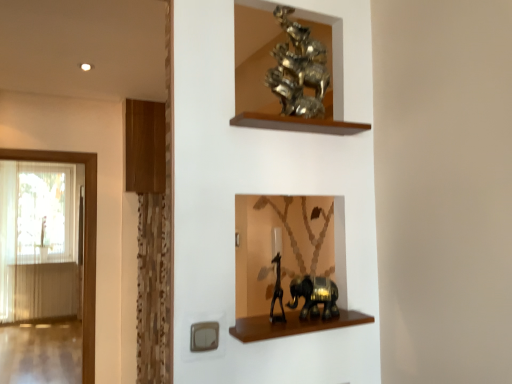
Question: Does brown wooden shelf at lower center, the second shelf viewed from the back, have a larger size compared to translucent glass door at left?

Choices:
 (A) yes
 (B) no

Answer: (B)

Question: Does brown wooden shelf at lower center, the first shelf positioned from the front, have a lesser width compared to translucent glass door at left?

Choices:
 (A) no
 (B) yes

Answer: (A)

Question: From a real-world perspective, is brown wooden shelf at lower center, the second shelf in the left-to-right sequence, on top of translucent glass door at left?

Choices:
 (A) yes
 (B) no

Answer: (A)

Question: Considering the relative sizes of brown wooden shelf at lower center, the second shelf viewed from the back, and translucent glass door at left in the image provided, is brown wooden shelf at lower center, the second shelf viewed from the back, wider than translucent glass door at left?

Choices:
 (A) no
 (B) yes

Answer: (B)

Question: From the image's perspective, is brown wooden shelf at lower center, the first shelf when ordered from bottom to top, beneath translucent glass door at left?

Choices:
 (A) yes
 (B) no

Answer: (B)

Question: Is brown wooden shelf at lower center, which ranks as the second shelf in top-to-bottom order, not close to translucent glass door at left?

Choices:
 (A) no
 (B) yes

Answer: (B)

Question: From the image's perspective, does wooden at left, marked as the second shelf in a bottom-to-top arrangement, appear higher than shiny black elephant at lower center, the first animal from the bottom?

Choices:
 (A) no
 (B) yes

Answer: (B)

Question: Would you say wooden at left, the first shelf when ordered from left to right, contains shiny black elephant at lower center, the first animal from the bottom?

Choices:
 (A) yes
 (B) no

Answer: (B)

Question: Is wooden at left, marked as the second shelf in a bottom-to-top arrangement, bigger than shiny black elephant at lower center, the first animal from the bottom?

Choices:
 (A) no
 (B) yes

Answer: (B)

Question: Is wooden at left, the second shelf positioned from the front, positioned in front of shiny black elephant at lower center, the first animal from the bottom?

Choices:
 (A) no
 (B) yes

Answer: (A)

Question: Is shiny black elephant at lower center, the first animal from the bottom, at the back of wooden at left, arranged as the first shelf when viewed from the back?

Choices:
 (A) yes
 (B) no

Answer: (B)

Question: Is wooden at left, marked as the second shelf in a bottom-to-top arrangement, to the left of shiny black elephant at lower center, arranged as the 3th animal when viewed from the top, from the viewer's perspective?

Choices:
 (A) yes
 (B) no

Answer: (A)

Question: Is brown wooden shelf at lower center, the second shelf viewed from the back, wider than shiny black elephant at lower center, arranged as the 3th animal when viewed from the top?

Choices:
 (A) yes
 (B) no

Answer: (A)